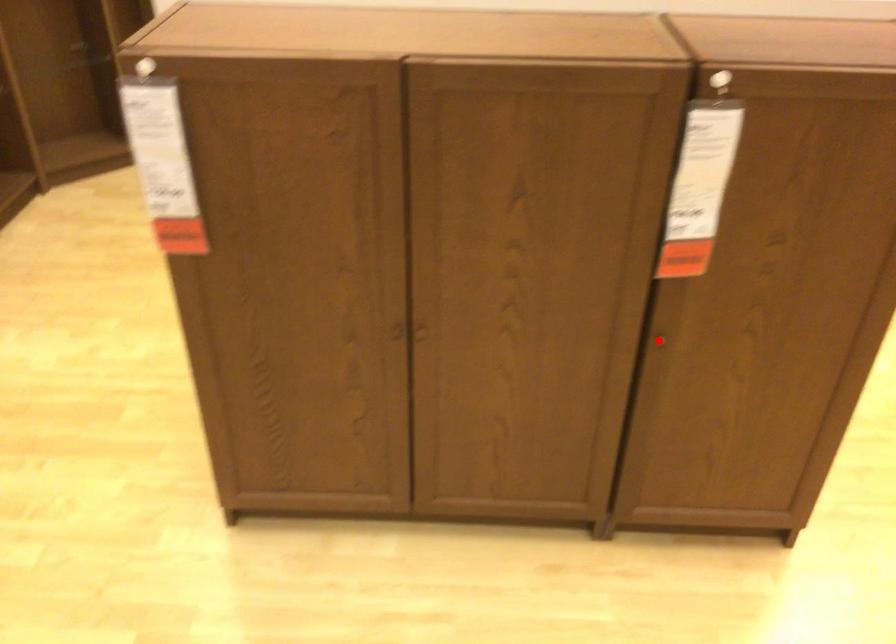
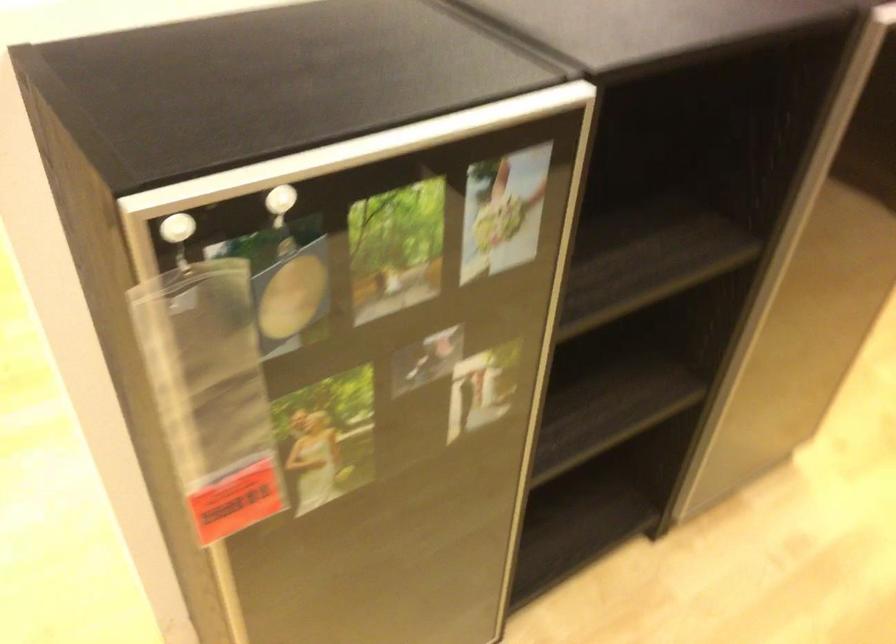
Question: I am providing you with two images of the same scene from different viewpoints. A red point is marked on the first image. At the location where the point appears in image 1, is it still visible in image 2?

Choices:
 (A) Yes
 (B) No

Answer: (B)